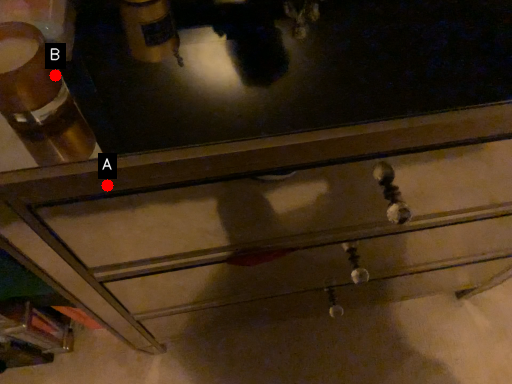
Question: Two points are circled on the image, labeled by A and B beside each circle. Which point appears farthest from the camera in this image?

Choices:
 (A) A is further
 (B) B is further

Answer: (A)